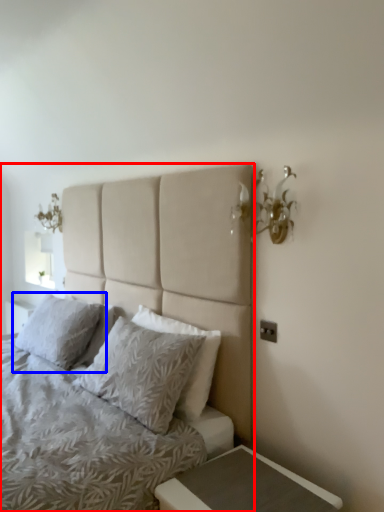
Question: Which point is further to the camera, bed (highlighted by a red box) or pillow (highlighted by a blue box)?

Choices:
 (A) bed
 (B) pillow

Answer: (B)